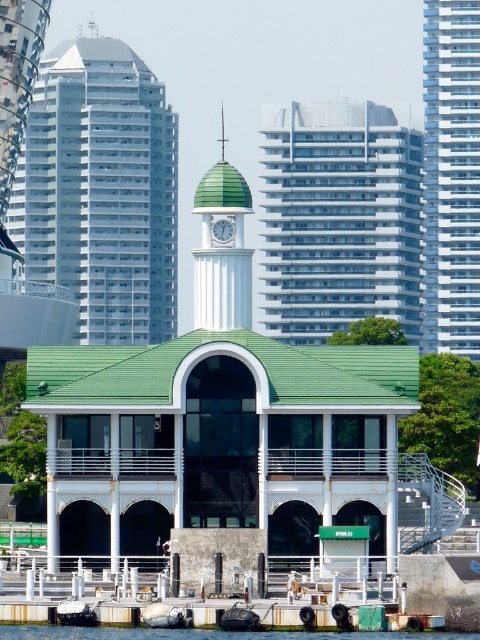
Is white rubber boat at lower center bigger than white plastic clock at center?

Yes, white rubber boat at lower center is bigger than white plastic clock at center.

Is white rubber boat at lower center to the right of white plastic clock at center from the viewer's perspective?

Incorrect, white rubber boat at lower center is not on the right side of white plastic clock at center.

This screenshot has height=640, width=480. What do you see at coordinates (165, 616) in the screenshot?
I see `white rubber boat at lower center` at bounding box center [165, 616].

At what (x,y) coordinates should I click in order to perform the action: click on white rubber boat at lower center. Please return your answer as a coordinate pair (x, y). Looking at the image, I should click on (165, 616).

Between white glass tower at right and white plastic clock at center, which one appears on the left side from the viewer's perspective?

white plastic clock at center

Between point (463, 212) and point (230, 237), which one is positioned behind?

Positioned behind is point (463, 212).

Image resolution: width=480 pixels, height=640 pixels. I want to click on white glass tower at right, so click(452, 176).

In the scene shown: Is the position of white glass building at center more distant than that of white rubber boat at lower center?

Yes, white glass building at center is behind white rubber boat at lower center.

Does white glass building at center have a larger size compared to white rubber boat at lower center?

Indeed, white glass building at center has a larger size compared to white rubber boat at lower center.

Who is more forward, (418, 186) or (159, 620)?

Positioned in front is point (159, 620).

Find the location of `white glass building at center`. white glass building at center is located at coordinates (337, 220).